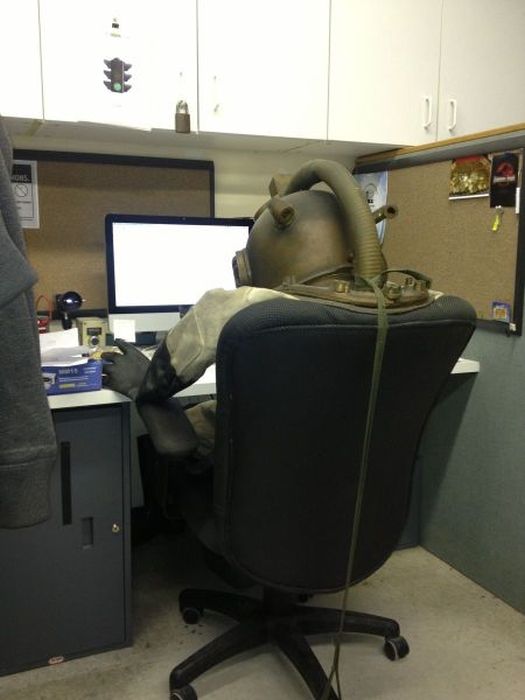
This screenshot has height=700, width=525. What are the coordinates of `monitor` in the screenshot? It's located at (194, 264).